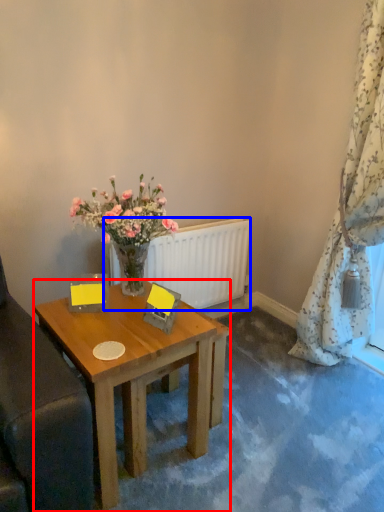
Question: Which of the following is the closest to the observer, desk (highlighted by a red box) or radiator (highlighted by a blue box)?

Choices:
 (A) desk
 (B) radiator

Answer: (A)